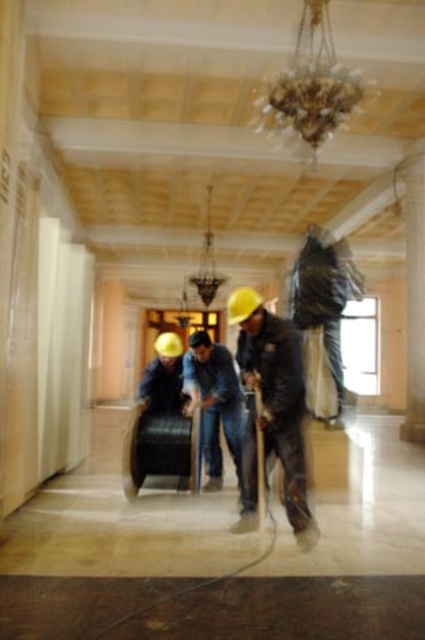
Question: Among these objects, which one is farthest from the camera?

Choices:
 (A) gold metallic chandelier at upper center
 (B) blue jeans at center
 (C) matte black jacket at center

Answer: (A)

Question: Among these objects, which one is nearest to the camera?

Choices:
 (A) matte black jacket at center
 (B) gold metallic chandelier at upper center
 (C) blue jeans at center

Answer: (A)

Question: Does gold metallic chandelier at upper center come in front of blue jeans at center?

Choices:
 (A) no
 (B) yes

Answer: (A)

Question: Which of these objects is positioned farthest from the matte black jacket at center?

Choices:
 (A) gold metallic chandelier at upper center
 (B) blue jeans at center

Answer: (A)

Question: Is matte black jacket at center smaller than gold metallic chandelier at upper center?

Choices:
 (A) no
 (B) yes

Answer: (B)

Question: Does gold metallic chandelier at upper center have a larger size compared to blue jeans at center?

Choices:
 (A) yes
 (B) no

Answer: (A)